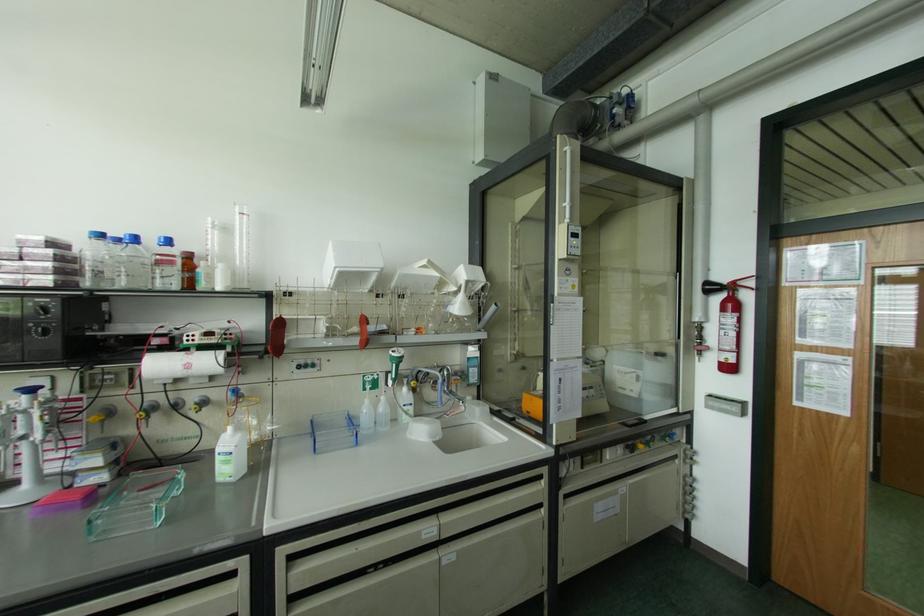
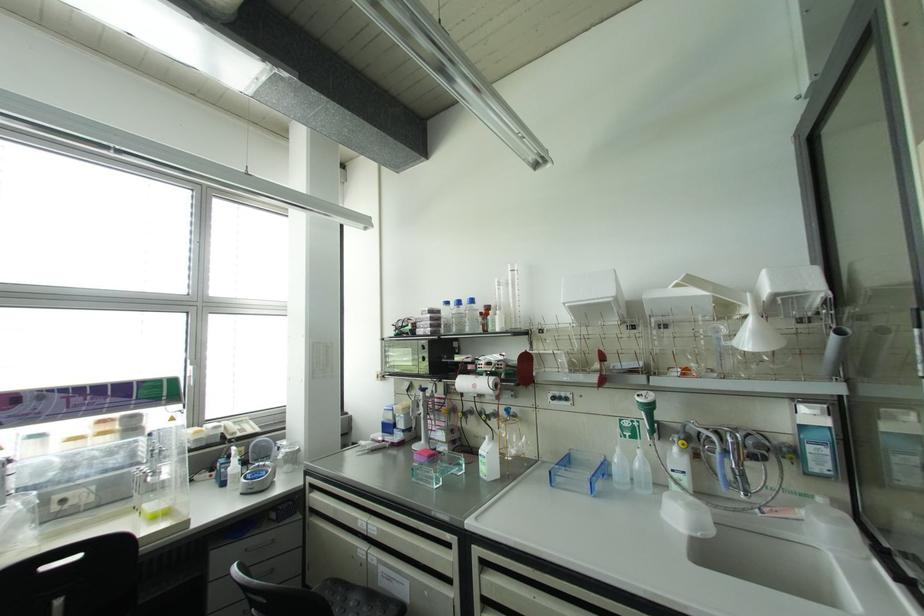
Find the pixel in the second image that matches pixel 394 379 in the first image.

(650, 432)